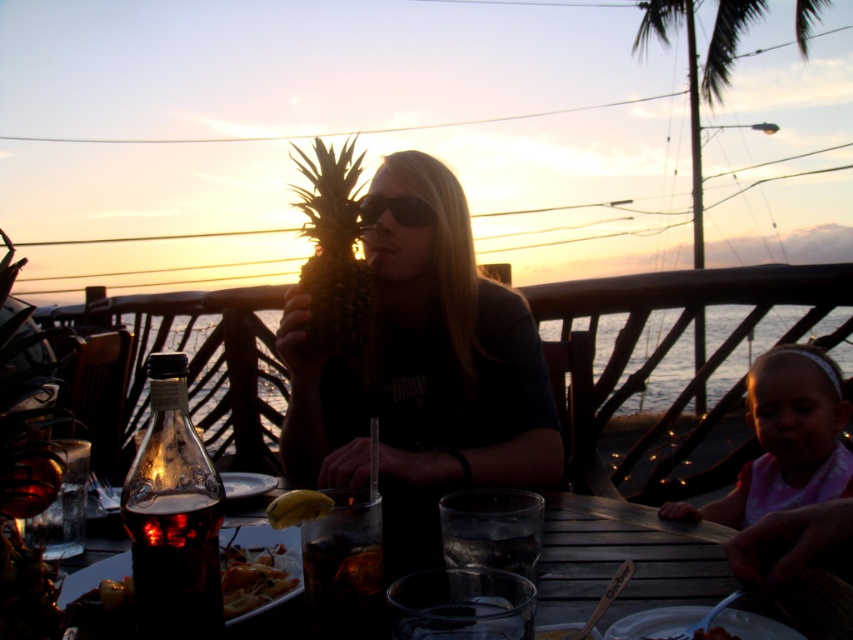
You are organizing a beach picnic and need to place a banana on the table. Given the sizes of the transparent glass table at center and the yellow matte banana at center, will the banana fit comfortably on the table without falling off?

The transparent glass table at center is larger in size than the yellow matte banana at center, so the banana will fit comfortably on the table without falling off.

You are planning to place a large decorative centerpiece on the transparent glass table at center. Considering the size of the table and the green leafy palm tree at upper right, will the palm tree obstruct the view of the centerpiece from the dining area?

The transparent glass table at center has a lesser width compared to the green leafy palm tree at upper right, meaning the palm tree is wider. However, since the palm tree is positioned at the upper right background, it would not obstruct the view of the centerpiece placed on the table in the foreground. The width difference here refers to the objects themselves, not their positions relative to the viewer.